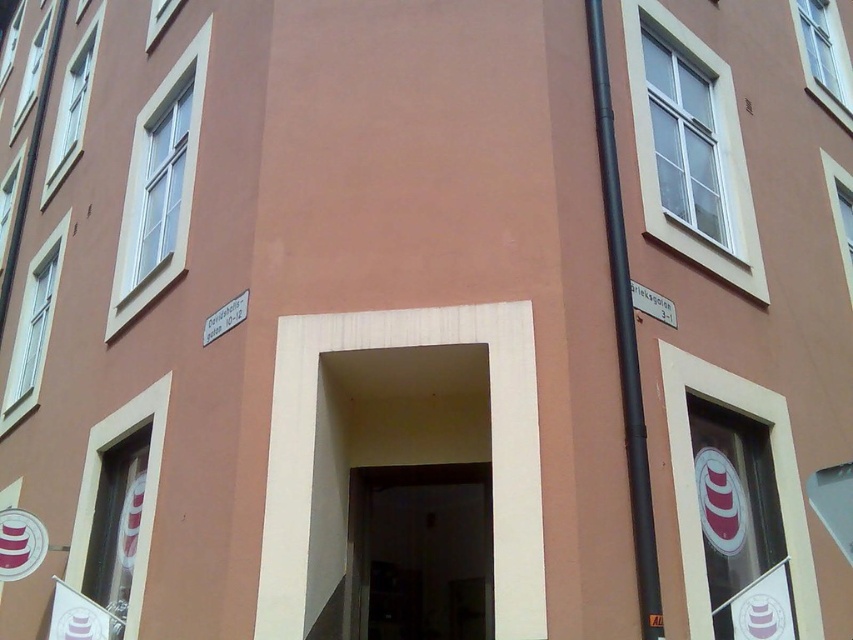
Question: Is dark wood door at center wider than white plastic street sign at upper right?

Choices:
 (A) no
 (B) yes

Answer: (B)

Question: Which object is the farthest from the black matte pipe at right?

Choices:
 (A) dark wood door at center
 (B) white plastic street sign at upper right

Answer: (A)

Question: Which point is farther to the camera?

Choices:
 (A) (636, 310)
 (B) (643, 461)

Answer: (A)

Question: Observing the image, what is the correct spatial positioning of dark wood door at center in reference to black matte pipe at right?

Choices:
 (A) below
 (B) above

Answer: (A)

Question: Which of the following is the farthest from the observer?

Choices:
 (A) [x=645, y=506]
 (B) [x=368, y=552]

Answer: (B)

Question: Does dark wood door at center have a larger size compared to white plastic street sign at upper right?

Choices:
 (A) yes
 (B) no

Answer: (A)